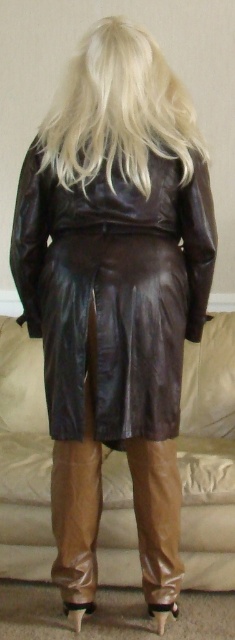
You are a fashion designer observing the image. You need to determine if the brown leather jacket at center can be worn over the blondehair at upper center without any adjustments. Based on their sizes, is this possible?

The brown leather jacket at center has a larger size compared to blondehair at upper center, so it can be worn over the blondehair at upper center without adjustments.

You are a fashion designer observing the scene. You need to decide whether the brown leather jacket at center can be seen above the blondehair at upper center when viewed from the front. Based on their positions in the image, what do you think?

The brown leather jacket at center is taller than blondehair at upper center, so when viewed from the front, the brown leather jacket at center would still be visible above the blondehair at upper center.

Please provide the coordinates of the brown leather jacket at center in the image. The coordinates should be in the format of a point with two decimal places, such as point [113,291]. The scene is the back view of a person wearing a long, dark brown leather coat and high boots, standing against a beige wall with light beige carpeting. You can see the person is wearing a long, dark brown leather coat with a glossy finish and straight cut with a slight flare at the bottom, and their blonde hair is cascaded

The brown leather jacket at center is located at point [113,291].